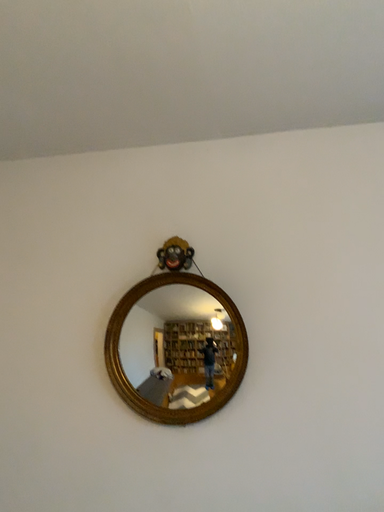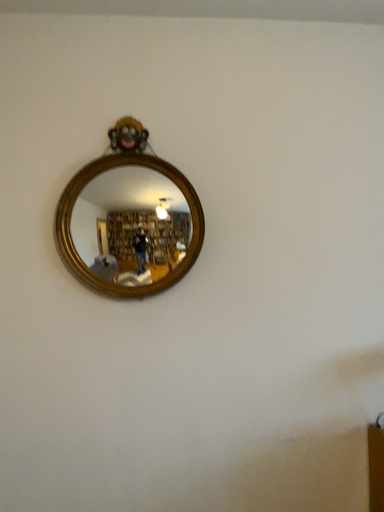
Question: How did the camera likely rotate when shooting the video?

Choices:
 (A) rotated downward
 (B) rotated upward

Answer: (A)